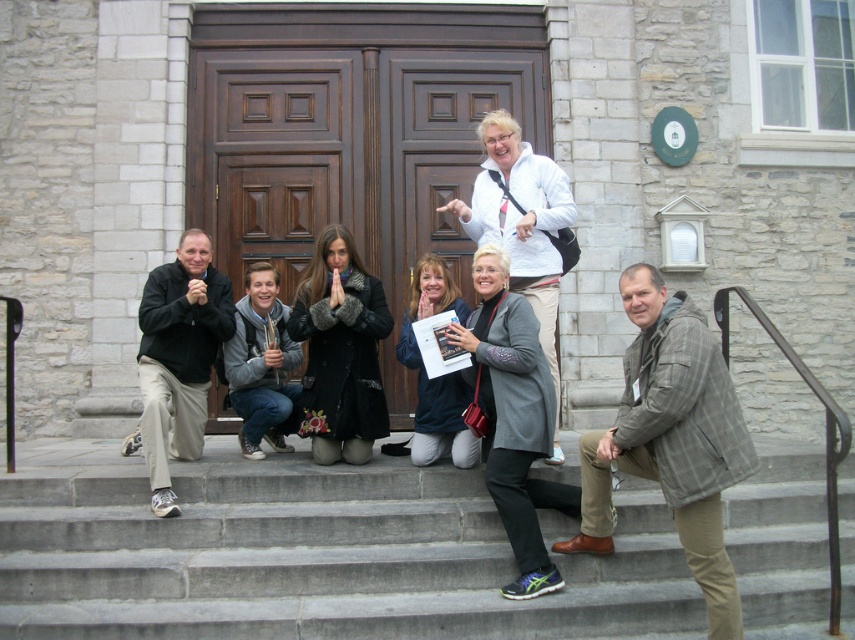
Question: Does gray plaid jacket at center have a lesser width compared to black matte pants at lower left?

Choices:
 (A) yes
 (B) no

Answer: (B)

Question: Can you confirm if gray concrete stairs at center is positioned to the left of gray plaid jacket at center?

Choices:
 (A) yes
 (B) no

Answer: (A)

Question: Which point appears farthest from the camera in this image?

Choices:
 (A) (164, 352)
 (B) (705, 445)
 (C) (215, 596)

Answer: (A)

Question: Which object is closer to the camera taking this photo?

Choices:
 (A) gray plaid jacket at center
 (B) black matte pants at lower left
 (C) gray concrete stairs at center

Answer: (A)

Question: Is gray concrete stairs at center to the left of gray plaid jacket at center from the viewer's perspective?

Choices:
 (A) no
 (B) yes

Answer: (B)

Question: Which point is closer to the camera?

Choices:
 (A) gray plaid jacket at center
 (B) black matte pants at lower left
 (C) gray concrete stairs at center

Answer: (A)